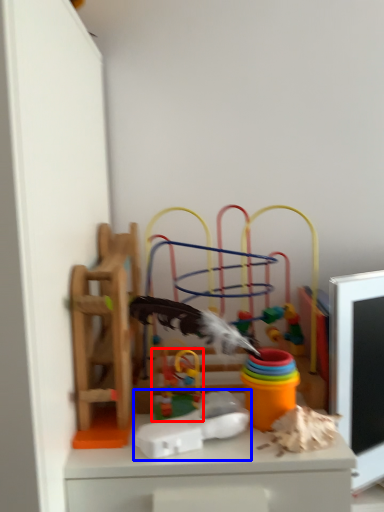
Question: Which object is closer to the camera taking this photo, toy (highlighted by a red box) or toy (highlighted by a blue box)?

Choices:
 (A) toy
 (B) toy

Answer: (B)